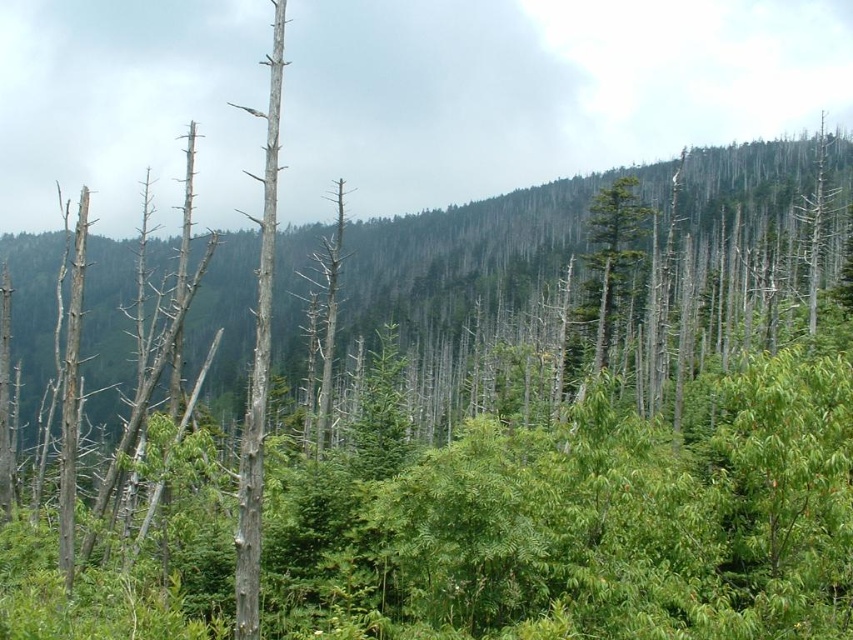
Question: Does green leafy trees at center have a smaller size compared to green matte tree at center?

Choices:
 (A) yes
 (B) no

Answer: (B)

Question: Can you confirm if green leafy trees at center is smaller than green matte tree at center?

Choices:
 (A) yes
 (B) no

Answer: (B)

Question: Can you confirm if green leafy trees at center is positioned to the left of green matte tree at center?

Choices:
 (A) yes
 (B) no

Answer: (A)